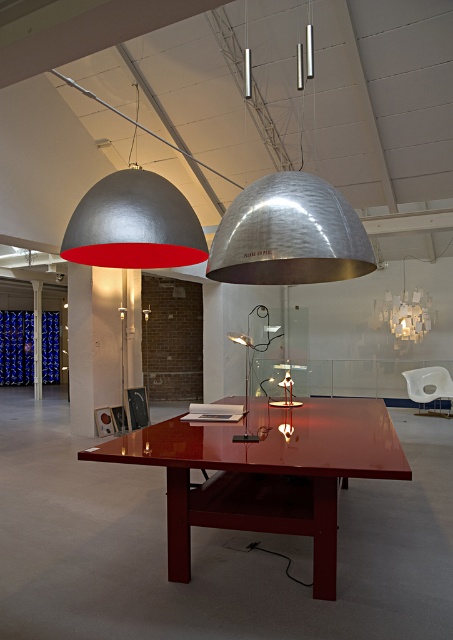
From the picture: You are an interior designer assessing the layout of the showroom. You need to move the metallic pillar at center closer to the entrance, which is behind the metallic dome lamp at upper center. Can you move the pillar without first moving the dome lamp?

The metallic dome lamp at upper center is closer to the viewer than the metallic pillar at center. Since the entrance is behind the dome lamp, the pillar is already positioned behind the dome lamp. Therefore, you can move the metallic pillar at center closer to the entrance without needing to first move the metallic dome lamp at upper center.

You are an interior designer assessing the layout of the showroom. You notice the metallic dome lamp at upper center and the metallic pillar at center. Which object would cast a wider shadow on the floor?

The metallic dome lamp at upper center has a larger size compared to the metallic pillar at center, so it would cast a wider shadow on the floor.